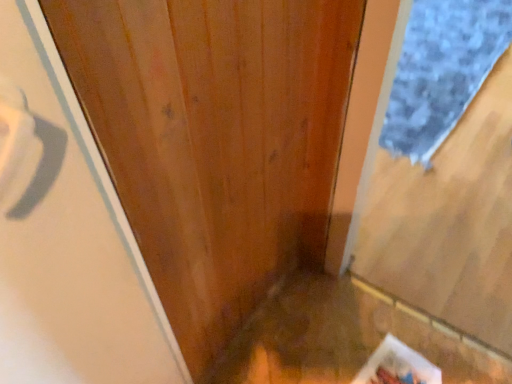
This screenshot has width=512, height=384. In order to click on white glossy screen door at left in this screenshot , I will do `click(69, 241)`.

What do you see at coordinates (69, 241) in the screenshot? I see `white glossy screen door at left` at bounding box center [69, 241].

Find the location of a particular element. The image size is (512, 384). blue textured mat at right is located at coordinates (442, 71).

Describe the element at coordinates (442, 71) in the screenshot. This screenshot has height=384, width=512. I see `blue textured mat at right` at that location.

Identify the location of white glossy screen door at left. The height and width of the screenshot is (384, 512). (69, 241).

Is blue textured mat at right at the right side of white glossy screen door at left?

Correct, you'll find blue textured mat at right to the right of white glossy screen door at left.

Between blue textured mat at right and white glossy screen door at left, which one is positioned behind?

blue textured mat at right is behind.

Is point (421, 34) positioned after point (46, 268)?

Yes.

From the image's perspective, does blue textured mat at right appear lower than white glossy screen door at left?

Actually, blue textured mat at right appears above white glossy screen door at left in the image.

Consider the image. From a real-world perspective, is blue textured mat at right on white glossy screen door at left?

Incorrect, from a real-world perspective, blue textured mat at right is lower than white glossy screen door at left.

Looking at their sizes, would you say blue textured mat at right is wider or thinner than white glossy screen door at left?

Clearly, blue textured mat at right has more width compared to white glossy screen door at left.

Between blue textured mat at right and white glossy screen door at left, which one has more height?

white glossy screen door at left.

Which of these two, blue textured mat at right or white glossy screen door at left, is smaller?

Smaller between the two is white glossy screen door at left.

Is blue textured mat at right not inside white glossy screen door at left?

Yes, blue textured mat at right is located beyond the bounds of white glossy screen door at left.

Looking at this image, would you say blue textured mat at right is a long distance from white glossy screen door at left?

Indeed, blue textured mat at right is not near white glossy screen door at left.

Is blue textured mat at right looking in the opposite direction of white glossy screen door at left?

blue textured mat at right is not turned away from white glossy screen door at left.

What's the angular difference between blue textured mat at right and white glossy screen door at left's facing directions?

87.9 degrees.

Locate an element on the screen. doormat on the right of white glossy screen door at left is located at coordinates (442, 71).

Considering the relative positions of white glossy screen door at left and blue textured mat at right in the image provided, is white glossy screen door at left to the left of blue textured mat at right from the viewer's perspective?

Yes.

Which is in front, white glossy screen door at left or blue textured mat at right?

white glossy screen door at left.

Between point (92, 295) and point (492, 4), which one is positioned in front?

Positioned in front is point (92, 295).

From the image's perspective, would you say white glossy screen door at left is positioned over blue textured mat at right?

No, from the image's perspective, white glossy screen door at left is not on top of blue textured mat at right.

From a real-world perspective, which is physically above, white glossy screen door at left or blue textured mat at right?

In real-world perspective, white glossy screen door at left is above.

Considering the sizes of white glossy screen door at left and blue textured mat at right in the image, is white glossy screen door at left wider or thinner than blue textured mat at right?

white glossy screen door at left is thinner than blue textured mat at right.

Consider the image. Who is taller, white glossy screen door at left or blue textured mat at right?

white glossy screen door at left is taller.

Considering the sizes of white glossy screen door at left and blue textured mat at right in the image, is white glossy screen door at left bigger or smaller than blue textured mat at right?

Clearly, white glossy screen door at left is smaller in size than blue textured mat at right.

Would you say white glossy screen door at left contains blue textured mat at right?

No.

Is white glossy screen door at left far from blue textured mat at right?

Yes, white glossy screen door at left and blue textured mat at right are located far from each other.

Is white glossy screen door at left aimed at blue textured mat at right?

No, white glossy screen door at left is not turned towards blue textured mat at right.

How much distance is there between white glossy screen door at left and blue textured mat at right?

white glossy screen door at left and blue textured mat at right are 6.94 feet apart.

This screenshot has width=512, height=384. I want to click on doormat on the right of white glossy screen door at left, so click(442, 71).

Where is `doormat lying on the right of white glossy screen door at left`? Image resolution: width=512 pixels, height=384 pixels. doormat lying on the right of white glossy screen door at left is located at coordinates (442, 71).

This screenshot has height=384, width=512. I want to click on doormat that appears below the white glossy screen door at left (from a real-world perspective), so click(x=442, y=71).